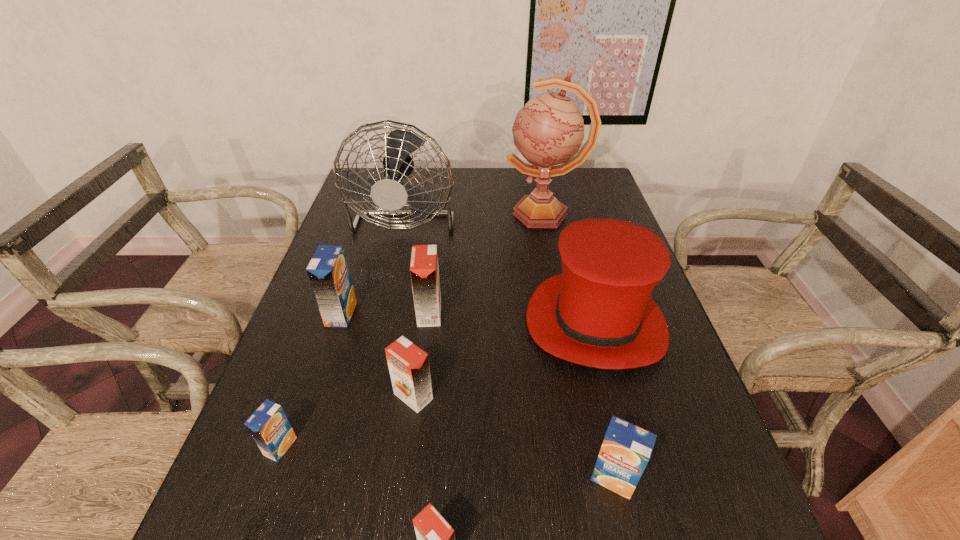
Identify which blue orange_juice is the third closest to the biggest orange orange juice. Please provide its 2D coordinates. Your answer should be formatted as a tuple, i.e. [(x, y)], where the tuple contains the x and y coordinates of a point satisfying the conditions above.

[(626, 449)]

The image size is (960, 540). What are the coordinates of `the third closest blue orange_juice to the nearest orange orange juice` in the screenshot? It's located at (328, 272).

Where is `orange orange juice that is the third closest to the seventh shortest object`? The height and width of the screenshot is (540, 960). orange orange juice that is the third closest to the seventh shortest object is located at coordinates (435, 537).

Where is `orange orange juice identified as the second closest to the biggest blue orange_juice`? This screenshot has width=960, height=540. orange orange juice identified as the second closest to the biggest blue orange_juice is located at coordinates (408, 364).

Locate an element on the screen. vacant region that satisfies the following two spatial constraints: 1. on the front-facing side of the hat; 2. on the right side of the eighth shortest object is located at coordinates (382, 321).

The width and height of the screenshot is (960, 540). What are the coordinates of `free region that satisfies the following two spatial constraints: 1. on the back side of the second farthest orange orange juice; 2. on the left side of the smallest blue orange_juice` in the screenshot? It's located at (299, 396).